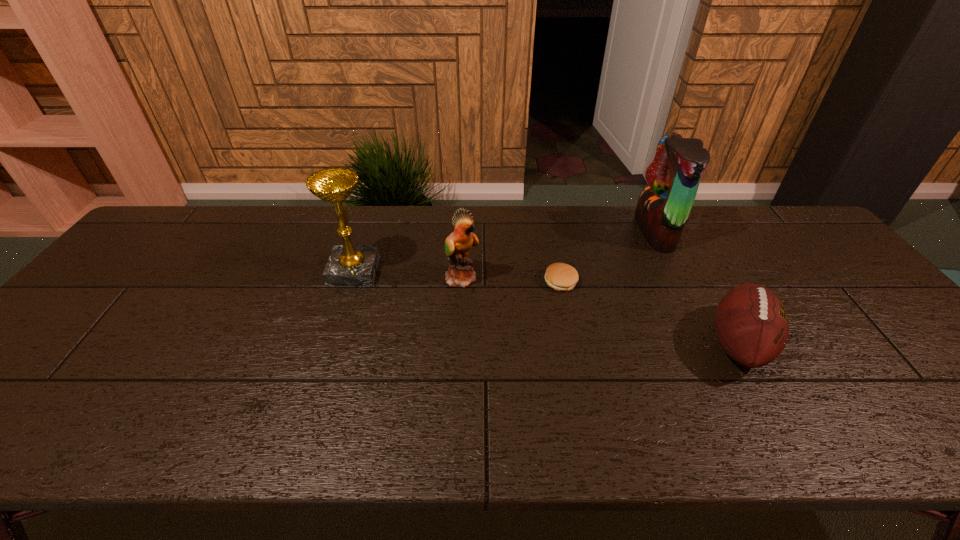
You are a GUI agent. You are given a task and a screenshot of the screen. Output one action in this format:
    pyautogui.click(x=<x>, y=<y>)
    Task: Click on the free space in the image that satisfies the following two spatial constraints: 1. at the face of the nearest object; 2. on the left side of the right parrot
    The width and height of the screenshot is (960, 540).
    Given the screenshot: What is the action you would take?
    pyautogui.click(x=710, y=344)

At what (x,y) coordinates should I click in order to perform the action: click on vacant space that satisfies the following two spatial constraints: 1. on the back side of the fourth tallest object; 2. at the face of the farther parrot. Please return your answer as a coordinate pair (x, y). The image size is (960, 540). Looking at the image, I should click on (676, 232).

This screenshot has width=960, height=540. Find the location of `vacant area that satisfies the following two spatial constraints: 1. on the front-facing side of the second shortest object; 2. on the left side of the second object from left to right`. vacant area that satisfies the following two spatial constraints: 1. on the front-facing side of the second shortest object; 2. on the left side of the second object from left to right is located at coordinates (459, 344).

The image size is (960, 540). I want to click on free space that satisfies the following two spatial constraints: 1. on the front-facing side of the award; 2. on the left side of the nearest object, so click(x=330, y=344).

At what (x,y) coordinates should I click in order to perform the action: click on vacant space that satisfies the following two spatial constraints: 1. on the front-facing side of the award; 2. on the back side of the shortest object. Please return your answer as a coordinate pair (x, y). Image resolution: width=960 pixels, height=540 pixels. Looking at the image, I should click on (350, 282).